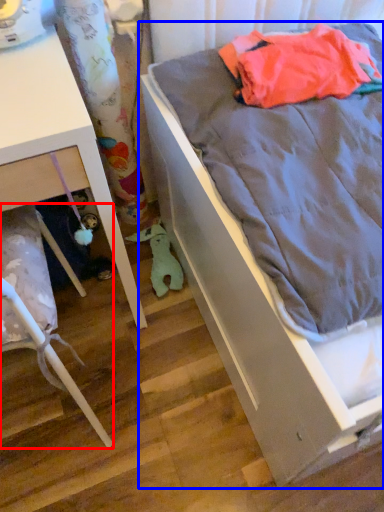
Question: Among these objects, which one is nearest to the camera, furniture (highlighted by a red box) or bed (highlighted by a blue box)?

Choices:
 (A) furniture
 (B) bed

Answer: (B)